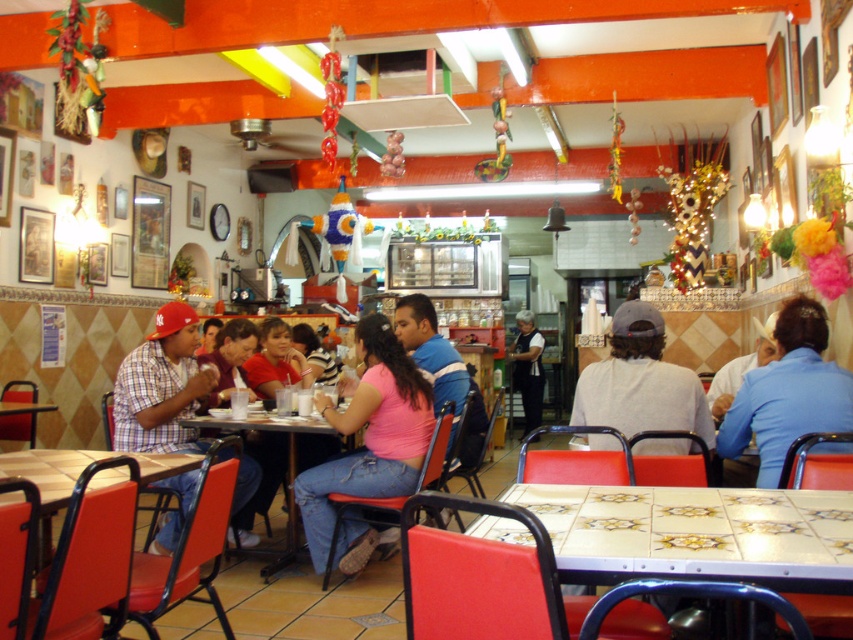
Question: Is blue fabric shirt at center in front of matte blue shirt at center?

Choices:
 (A) yes
 (B) no

Answer: (A)

Question: Can you confirm if blue fabric shirt at center is positioned below matte blue shirt at center?

Choices:
 (A) yes
 (B) no

Answer: (B)

Question: Which object is farther from the camera taking this photo?

Choices:
 (A) matte blue shirt at center
 (B) matte pink shirt at center
 (C) white tile table at lower right

Answer: (B)

Question: Is blue fabric shirt at center positioned at the back of matte pink shirt at center?

Choices:
 (A) yes
 (B) no

Answer: (B)

Question: Which of the following is the farthest from the observer?

Choices:
 (A) (727, 518)
 (B) (769, 344)
 (C) (688, 369)

Answer: (B)

Question: Considering the real-world distances, which object is farthest from the blue fabric shirt at center?

Choices:
 (A) white tile table at lower right
 (B) metallic red table at lower left
 (C) white matte shirt at center
 (D) pink fabric shirt at center

Answer: (D)